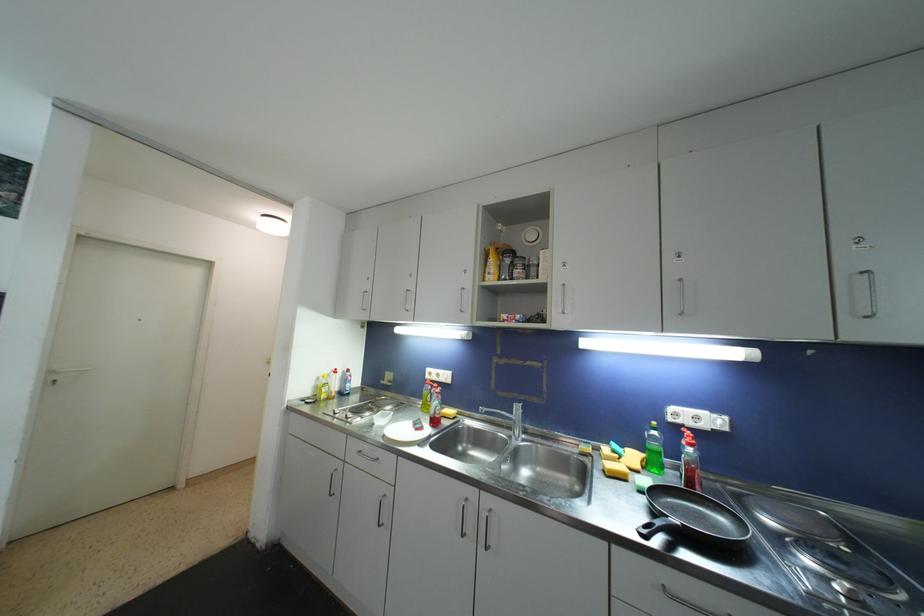
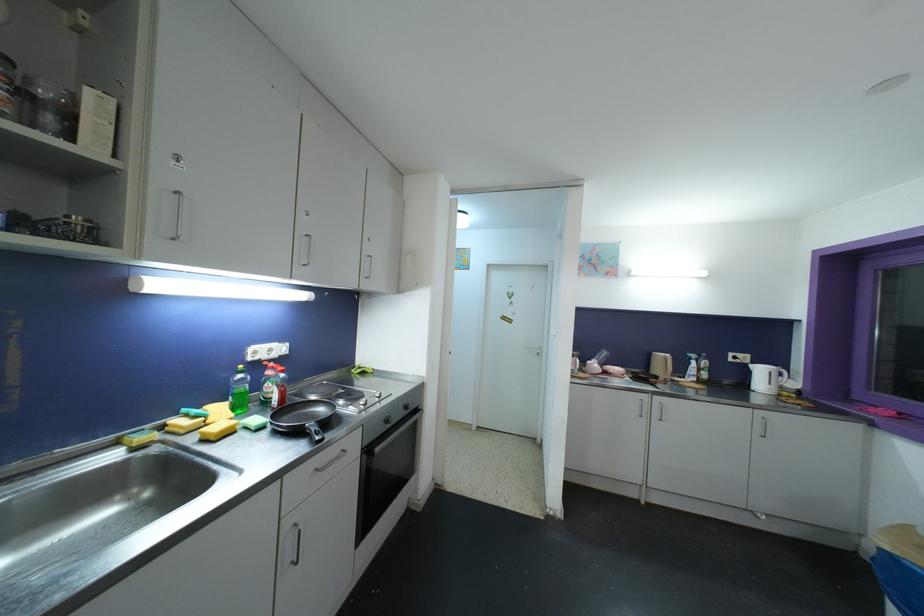
In the second image, find the point that corresponds to the point at 648,533 in the first image.

(321, 440)